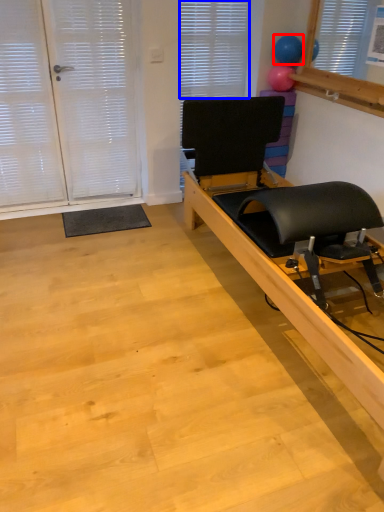
Question: Which object is further to the camera taking this photo, balloon (highlighted by a red box) or blind (highlighted by a blue box)?

Choices:
 (A) balloon
 (B) blind

Answer: (B)